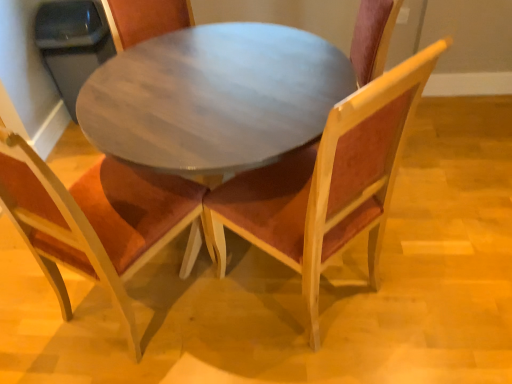
Question: Can you confirm if wooden chair with orange cushion at center, which is the first chair from left to right, is smaller than velvet burgundy chair at center, arranged as the first chair when viewed from the right?

Choices:
 (A) no
 (B) yes

Answer: (B)

Question: Is velvet burgundy chair at center, placed as the second chair when sorted from left to right, at the back of wooden chair with orange cushion at center, which is the first chair from left to right?

Choices:
 (A) yes
 (B) no

Answer: (B)

Question: Considering the relative positions of wooden chair with orange cushion at center, which ranks as the second chair in right-to-left order, and velvet burgundy chair at center, placed as the second chair when sorted from left to right, in the image provided, is wooden chair with orange cushion at center, which ranks as the second chair in right-to-left order, to the left of velvet burgundy chair at center, placed as the second chair when sorted from left to right, from the viewer's perspective?

Choices:
 (A) yes
 (B) no

Answer: (A)

Question: Would you say wooden chair with orange cushion at center, which is the first chair from left to right, contains velvet burgundy chair at center, placed as the second chair when sorted from left to right?

Choices:
 (A) no
 (B) yes

Answer: (A)

Question: Can you confirm if wooden chair with orange cushion at center, which ranks as the second chair in right-to-left order, is positioned to the right of velvet burgundy chair at center, placed as the second chair when sorted from left to right?

Choices:
 (A) no
 (B) yes

Answer: (A)

Question: Is wooden chair with orange cushion at center, which is the first chair from left to right, in front of velvet burgundy chair at center, placed as the second chair when sorted from left to right?

Choices:
 (A) no
 (B) yes

Answer: (A)

Question: Is wooden chair with orange cushion at center, which ranks as the second chair in right-to-left order, positioned behind wooden round table at center?

Choices:
 (A) no
 (B) yes

Answer: (A)

Question: From a real-world perspective, is wooden chair with orange cushion at center, which is the first chair from left to right, positioned over wooden round table at center based on gravity?

Choices:
 (A) yes
 (B) no

Answer: (A)

Question: Is the depth of wooden chair with orange cushion at center, which ranks as the second chair in right-to-left order, less than that of wooden round table at center?

Choices:
 (A) yes
 (B) no

Answer: (A)

Question: Is the surface of wooden chair with orange cushion at center, which is the first chair from left to right, in direct contact with wooden round table at center?

Choices:
 (A) yes
 (B) no

Answer: (B)

Question: Can you confirm if wooden chair with orange cushion at center, which ranks as the second chair in right-to-left order, is thinner than wooden round table at center?

Choices:
 (A) yes
 (B) no

Answer: (A)

Question: Considering the relative sizes of wooden chair with orange cushion at center, which is the first chair from left to right, and wooden round table at center in the image provided, is wooden chair with orange cushion at center, which is the first chair from left to right, taller than wooden round table at center?

Choices:
 (A) no
 (B) yes

Answer: (B)

Question: Is velvet burgundy chair at center, placed as the second chair when sorted from left to right, a part of wooden round table at center?

Choices:
 (A) yes
 (B) no

Answer: (A)